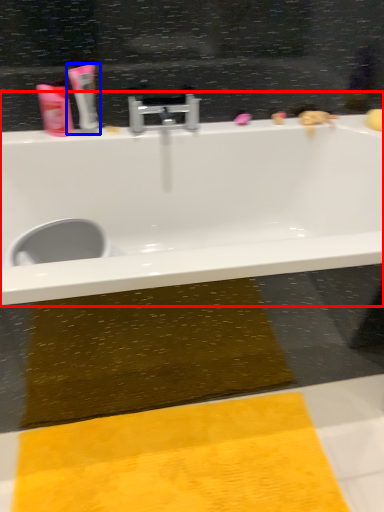
Question: Which object is closer to the camera taking this photo, bathtub (highlighted by a red box) or toothpaste (highlighted by a blue box)?

Choices:
 (A) bathtub
 (B) toothpaste

Answer: (A)